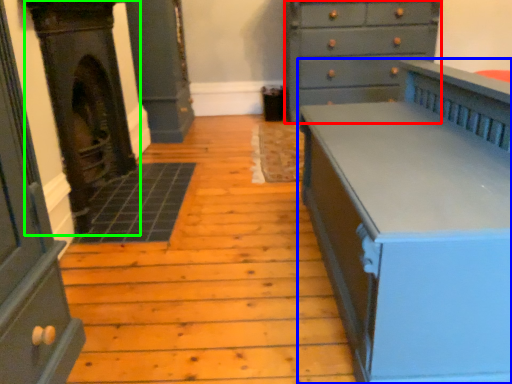
Question: Estimate the real-world distances between objects in this image. Which object is closer to chest of drawers (highlighted by a red box), chest of drawers (highlighted by a blue box) or fireplace (highlighted by a green box)?

Choices:
 (A) chest of drawers
 (B) fireplace

Answer: (A)